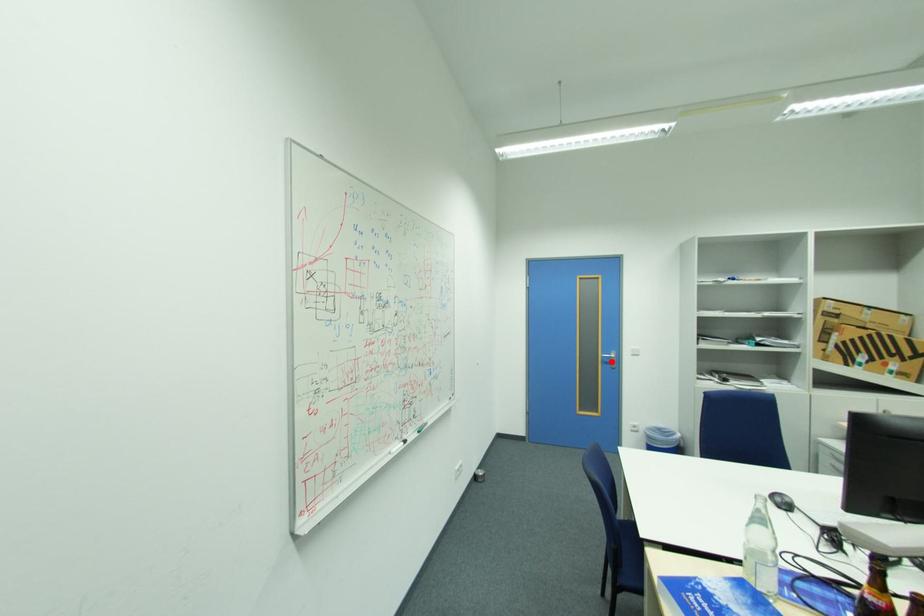
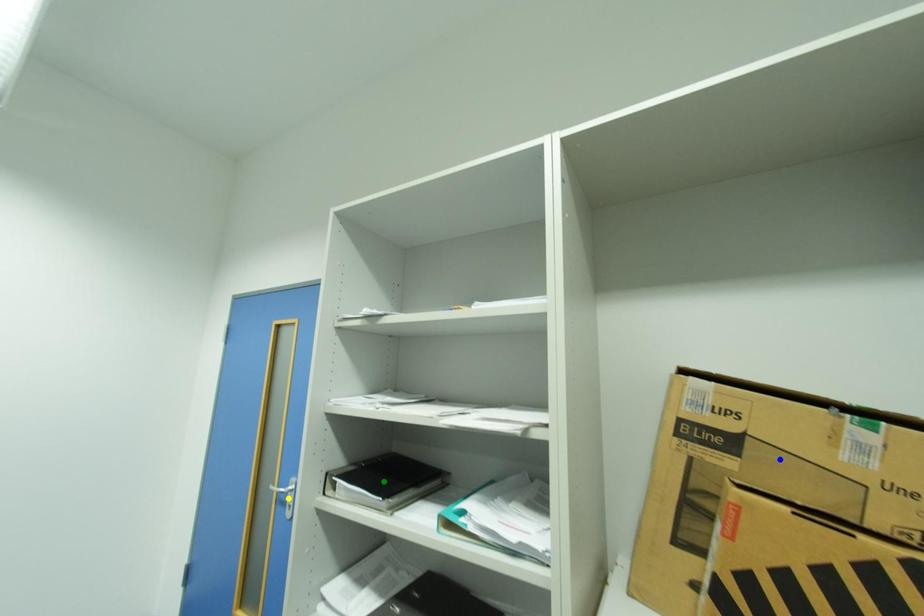
Question: I am providing you with two images of the same scene from different viewpoints. A red point is marked on the first image. You are given multiple points on the second image. Which point in image 2 is actually the same real-world point as the red point in image 1?

Choices:
 (A) blue point
 (B) green point
 (C) yellow point

Answer: (C)